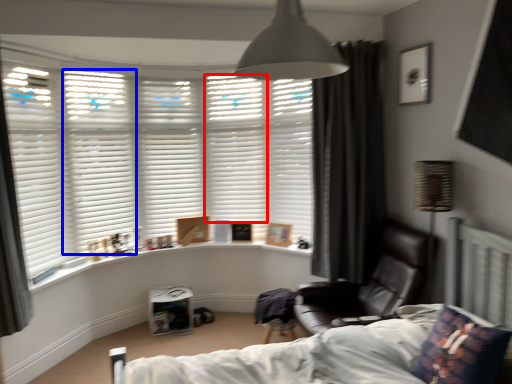
Question: Which of the following is the closest to the observer, shutter (highlighted by a red box) or shutter (highlighted by a blue box)?

Choices:
 (A) shutter
 (B) shutter

Answer: (B)